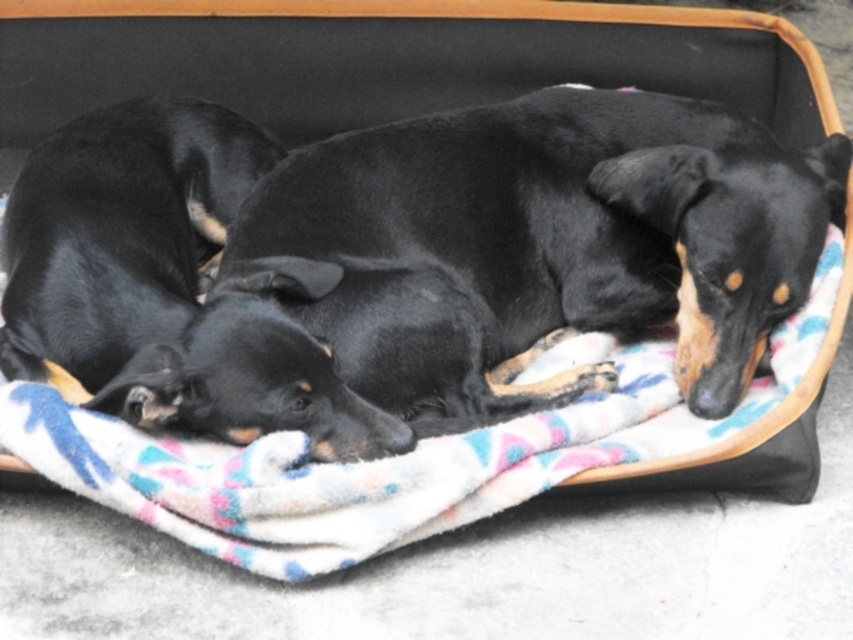
Question: Which point is farther to the camera?

Choices:
 (A) (555, 237)
 (B) (172, 196)

Answer: (B)

Question: Considering the real-world distances, which object is farthest from the black smooth dog at center?

Choices:
 (A) fuzzy multicolored blanket at center
 (B) black smooth dog at left

Answer: (B)

Question: Is fuzzy multicolored blanket at center further to camera compared to black smooth dog at left?

Choices:
 (A) yes
 (B) no

Answer: (B)

Question: Does black smooth dog at center appear on the right side of fuzzy multicolored blanket at center?

Choices:
 (A) yes
 (B) no

Answer: (A)

Question: Is black smooth dog at center smaller than black smooth dog at left?

Choices:
 (A) no
 (B) yes

Answer: (A)

Question: Which of these objects is positioned farthest from the black smooth dog at left?

Choices:
 (A) fuzzy multicolored blanket at center
 (B) black smooth dog at center

Answer: (A)